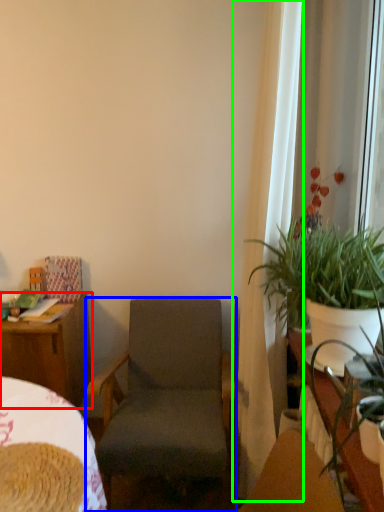
Question: Which is farther away from desk (highlighted by a red box)? chair (highlighted by a blue box) or curtain (highlighted by a green box)?

Choices:
 (A) chair
 (B) curtain

Answer: (B)